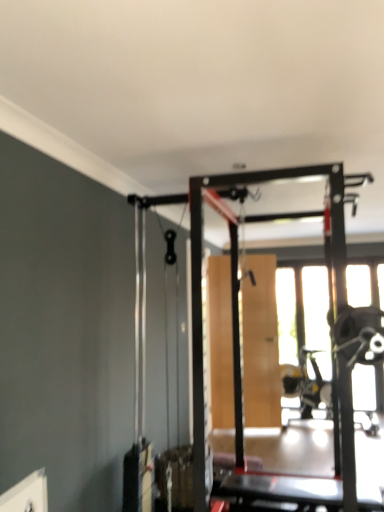
Question: Visually, is wooden screen door at center positioned to the left or to the right of transparent glass window at center?

Choices:
 (A) right
 (B) left

Answer: (B)

Question: Would you say wooden screen door at center is inside or outside transparent glass window at center?

Choices:
 (A) outside
 (B) inside

Answer: (A)

Question: Considering the positions of point (251, 372) and point (329, 343), is point (251, 372) closer or farther from the camera than point (329, 343)?

Choices:
 (A) farther
 (B) closer

Answer: (A)

Question: From a real-world perspective, relative to wooden screen door at center, is transparent glass window at center vertically above or below?

Choices:
 (A) above
 (B) below

Answer: (A)

Question: Relative to wooden screen door at center, is transparent glass window at center in front or behind?

Choices:
 (A) behind
 (B) front

Answer: (A)

Question: Is point (284, 279) closer or farther from the camera than point (258, 375)?

Choices:
 (A) farther
 (B) closer

Answer: (A)

Question: From their relative heights in the image, would you say transparent glass window at center is taller or shorter than wooden screen door at center?

Choices:
 (A) short
 (B) tall

Answer: (B)